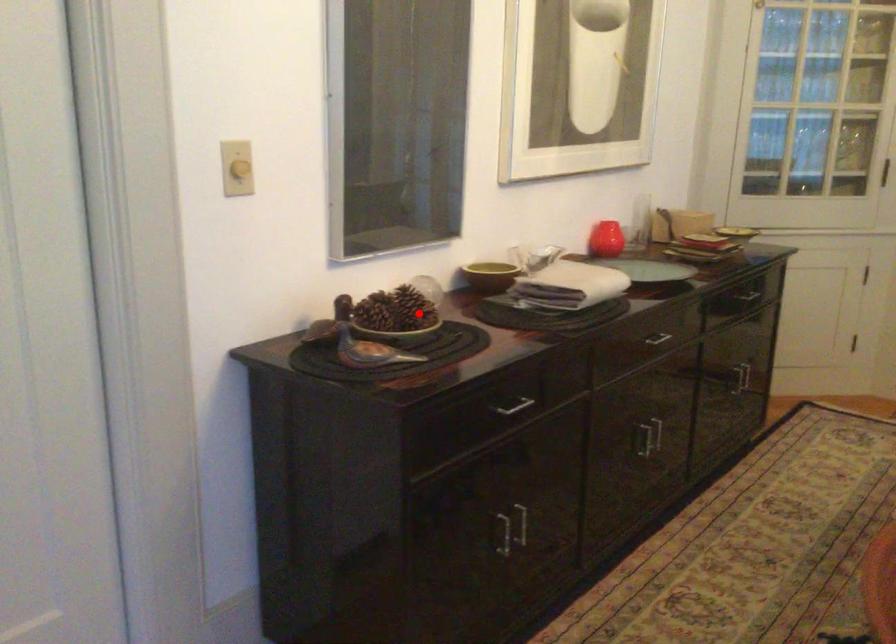
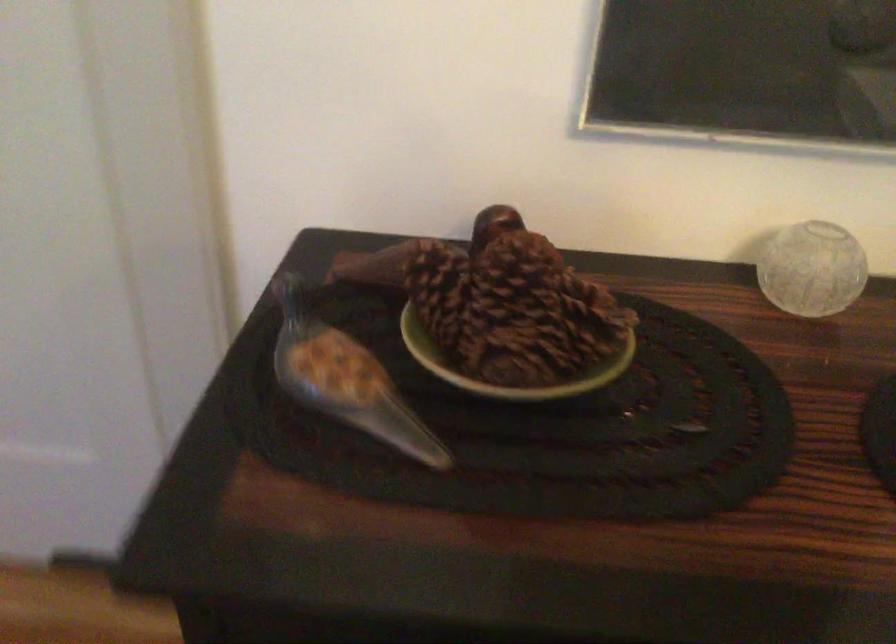
Locate, in the second image, the point that corresponds to the highlighted location in the first image.

(506, 366)